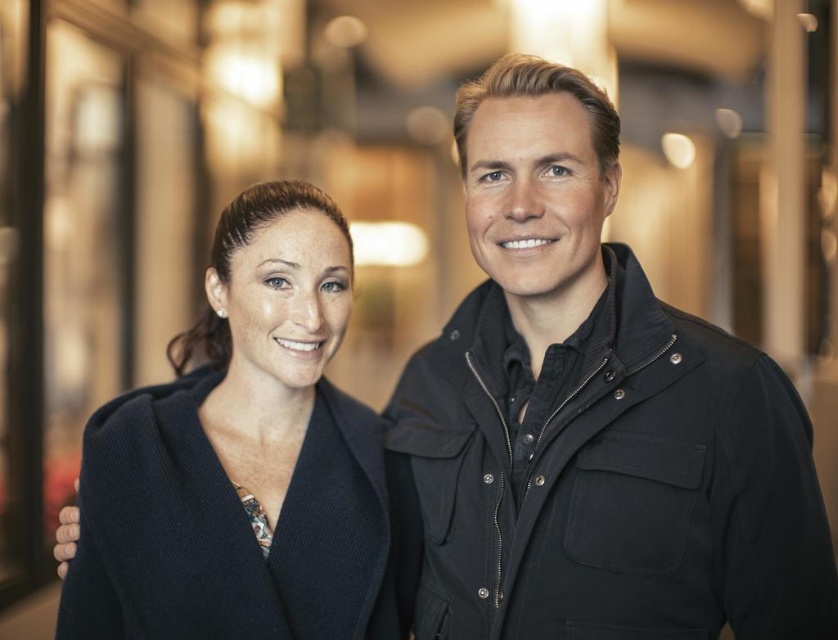
Can you confirm if black matte jacket at center is positioned below matte black coat at left?

Incorrect, black matte jacket at center is not positioned below matte black coat at left.

This screenshot has height=640, width=838. I want to click on black matte jacket at center, so click(593, 416).

Is point (681, 385) behind point (342, 484)?

No.

This screenshot has width=838, height=640. I want to click on black matte jacket at center, so click(593, 416).